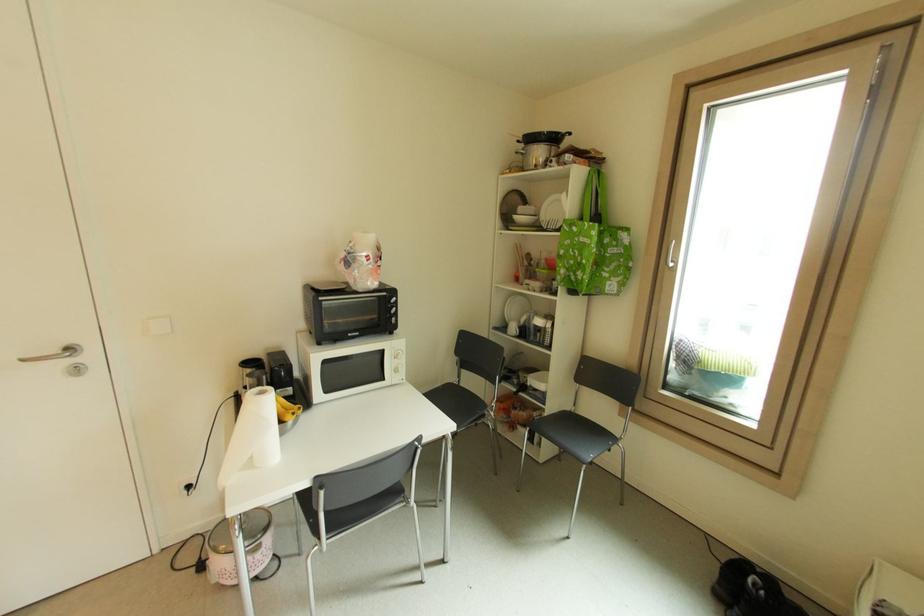
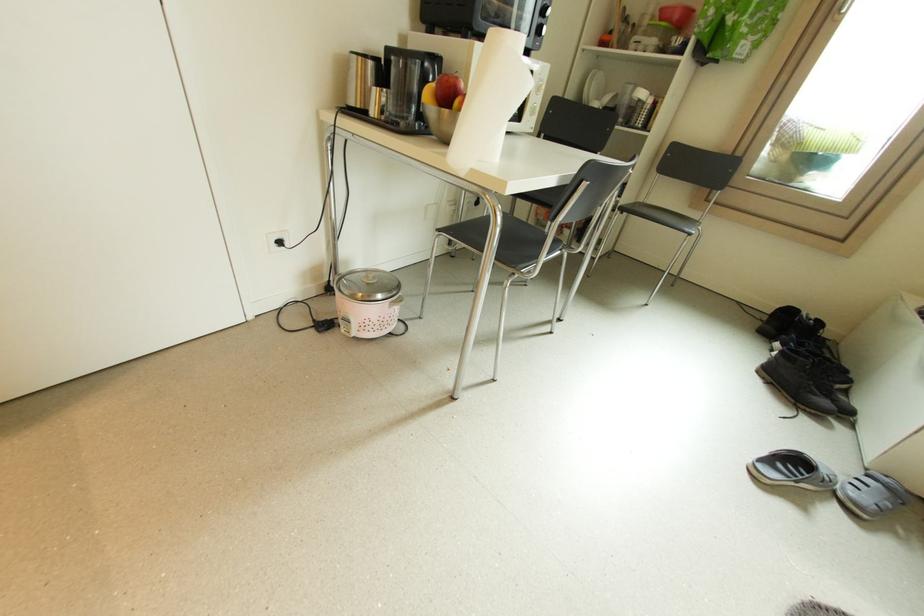
Where in the second image is the point corresponding to [195,487] from the first image?

(286, 243)